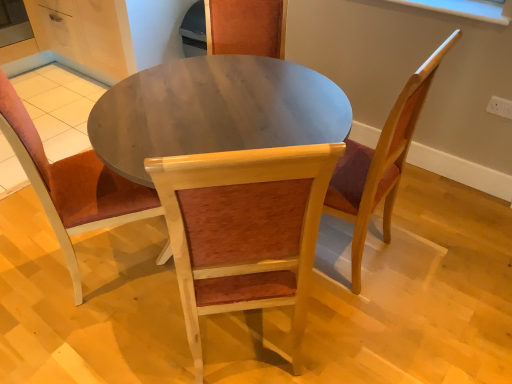
Locate an element on the screen. free space in front of wooden chair at center, the third chair in the right-to-left sequence is located at coordinates (85, 336).